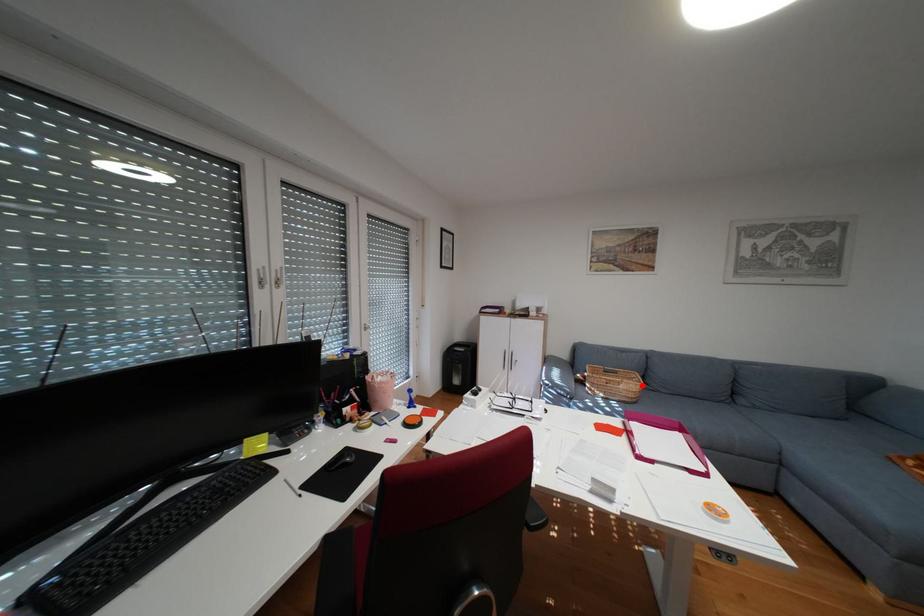
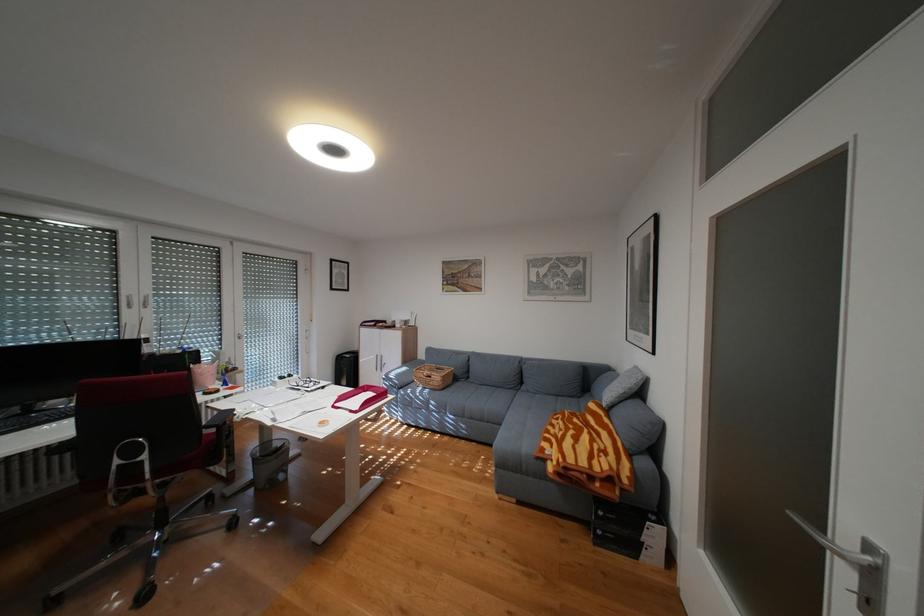
Question: A red point is marked in image1. In image2, is the corresponding 3D point closer to the camera or farther? Reply with the corresponding letter.

Choices:
 (A) The corresponding 3D point is closer.
 (B) The corresponding 3D point is farther.

Answer: (B)